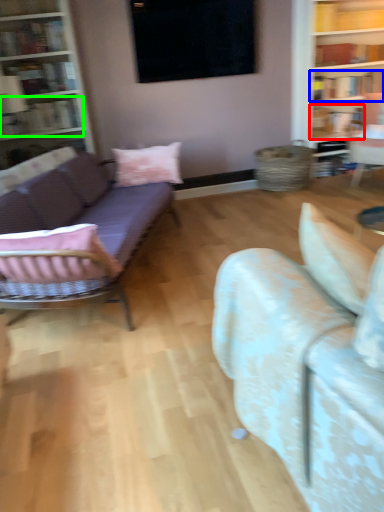
Question: Which object is the closest to the book (highlighted by a red box)? Choose among these: book (highlighted by a blue box) or book (highlighted by a green box).

Choices:
 (A) book
 (B) book

Answer: (A)